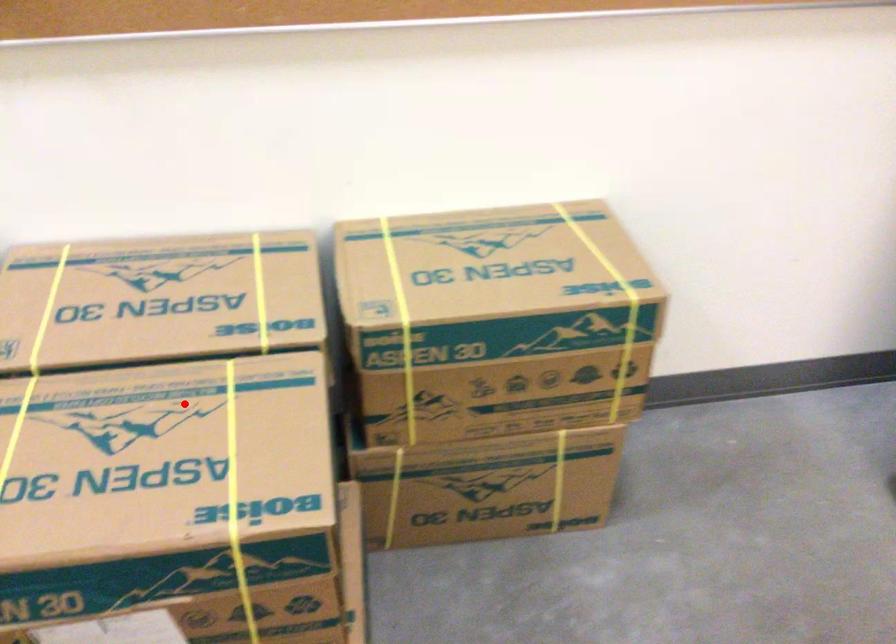
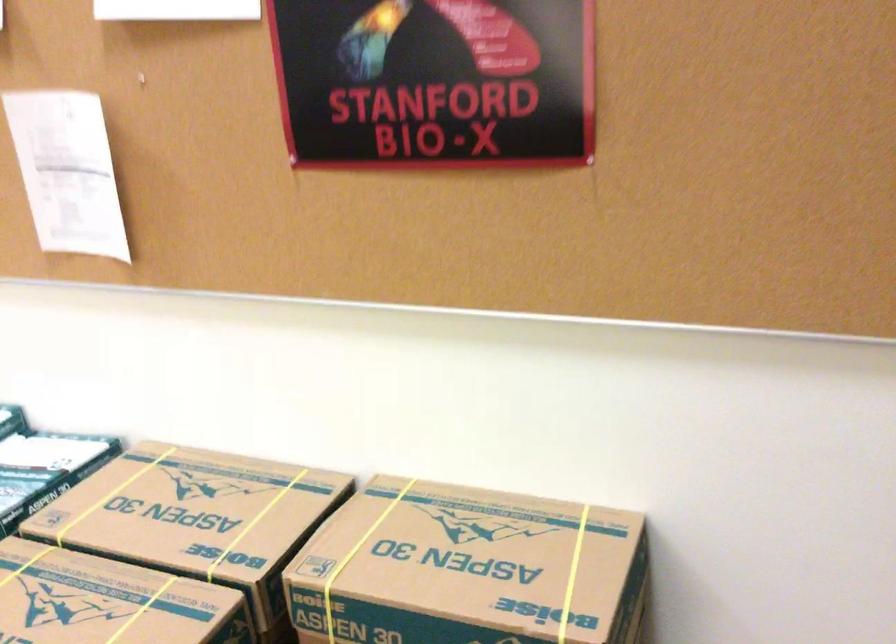
Find the pixel in the second image that matches the highlighted location in the first image.

(108, 601)